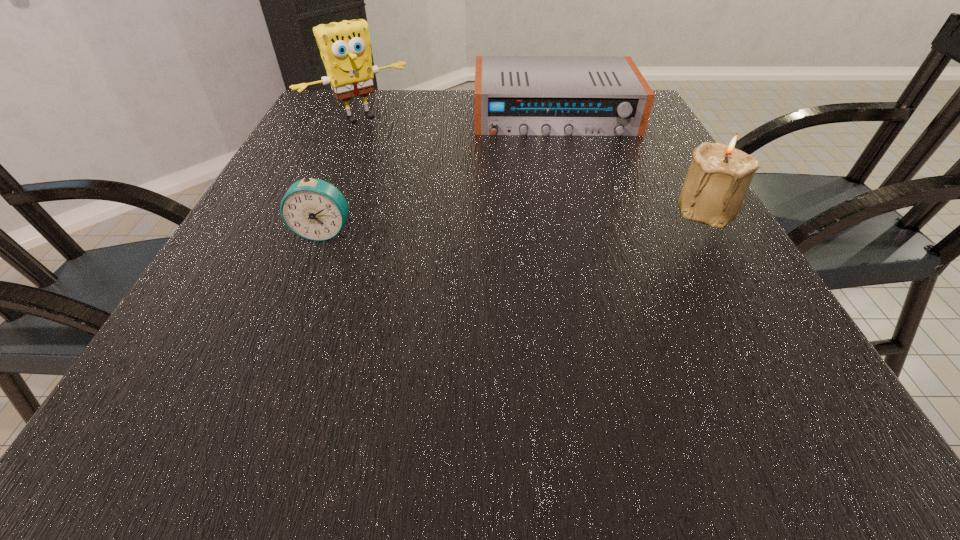
Where is `vacant space at the far edge of the desktop`? The image size is (960, 540). vacant space at the far edge of the desktop is located at coordinates pyautogui.click(x=442, y=98).

Where is `free region at the near edge`? The height and width of the screenshot is (540, 960). free region at the near edge is located at coordinates (520, 373).

The height and width of the screenshot is (540, 960). I want to click on vacant space at the left edge of the desktop, so click(x=221, y=265).

In the image, there is a desktop. Find the location of `vacant region at the right edge`. vacant region at the right edge is located at coordinates (656, 272).

The image size is (960, 540). In order to click on free area in between the alarm clock and the second tallest object in this screenshot , I will do `click(516, 220)`.

Identify the location of free space that is in between the tallest object and the alarm clock. (342, 175).

Locate an element on the screen. The image size is (960, 540). unoccupied position between the sponge and the alarm clock is located at coordinates (342, 175).

Identify the location of empty location between the candle_holder and the sponge. (535, 163).

You are a GUI agent. You are given a task and a screenshot of the screen. Output one action in this format:
    pyautogui.click(x=<x>, y=<y>)
    Task: Click on the free point between the shortest object and the tallest object
    Image resolution: width=960 pixels, height=540 pixels.
    Given the screenshot: What is the action you would take?
    pyautogui.click(x=457, y=116)

The height and width of the screenshot is (540, 960). What are the coordinates of `vacant space that's between the sponge and the shortest object` in the screenshot? It's located at (457, 116).